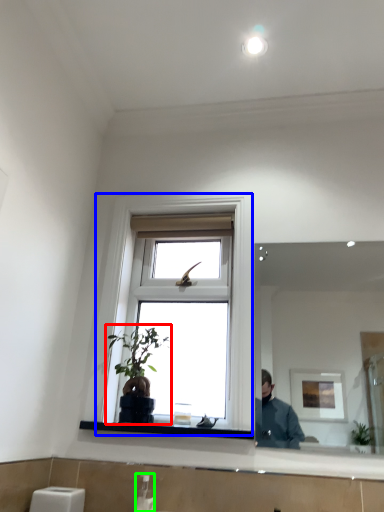
Question: Based on their relative distances, which object is nearer to houseplant (highlighted by a red box)? Choose from window (highlighted by a blue box) and soap dispenser (highlighted by a green box).

Choices:
 (A) window
 (B) soap dispenser

Answer: (A)